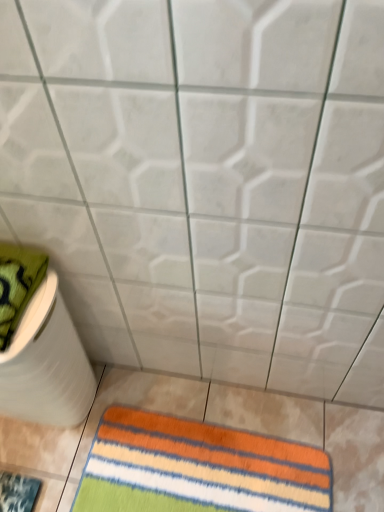
Question: Is white matte toilet paper at lower left taller than green textured towel at left?

Choices:
 (A) no
 (B) yes

Answer: (B)

Question: Are white matte toilet paper at lower left and green textured towel at left beside each other?

Choices:
 (A) yes
 (B) no

Answer: (B)

Question: Is white matte toilet paper at lower left closer to camera compared to green textured towel at left?

Choices:
 (A) no
 (B) yes

Answer: (A)

Question: Considering the relative positions of white matte toilet paper at lower left and green textured towel at left in the image provided, is white matte toilet paper at lower left to the left of green textured towel at left from the viewer's perspective?

Choices:
 (A) no
 (B) yes

Answer: (A)

Question: Is white matte toilet paper at lower left surrounding green textured towel at left?

Choices:
 (A) yes
 (B) no

Answer: (B)

Question: From a real-world perspective, is white matte toilet paper at lower left above or below multicolored striped rug at lower center?

Choices:
 (A) above
 (B) below

Answer: (A)

Question: In terms of height, does white matte toilet paper at lower left look taller or shorter compared to multicolored striped rug at lower center?

Choices:
 (A) short
 (B) tall

Answer: (B)

Question: Is point (61, 418) closer or farther from the camera than point (195, 464)?

Choices:
 (A) closer
 (B) farther

Answer: (B)

Question: In terms of width, does white matte toilet paper at lower left look wider or thinner when compared to multicolored striped rug at lower center?

Choices:
 (A) thin
 (B) wide

Answer: (A)

Question: Considering the positions of green textured towel at left and multicolored striped rug at lower center in the image, is green textured towel at left bigger or smaller than multicolored striped rug at lower center?

Choices:
 (A) big
 (B) small

Answer: (A)

Question: From a real-world perspective, is green textured towel at left positioned above or below multicolored striped rug at lower center?

Choices:
 (A) below
 (B) above

Answer: (B)

Question: From the image's perspective, is green textured towel at left above or below multicolored striped rug at lower center?

Choices:
 (A) above
 (B) below

Answer: (A)

Question: Would you say green textured towel at left is inside or outside multicolored striped rug at lower center?

Choices:
 (A) inside
 (B) outside

Answer: (B)

Question: From the image's perspective, is green textured towel at left above or below white matte toilet paper at lower left?

Choices:
 (A) above
 (B) below

Answer: (A)

Question: Is green textured towel at left inside the boundaries of white matte toilet paper at lower left, or outside?

Choices:
 (A) outside
 (B) inside

Answer: (A)